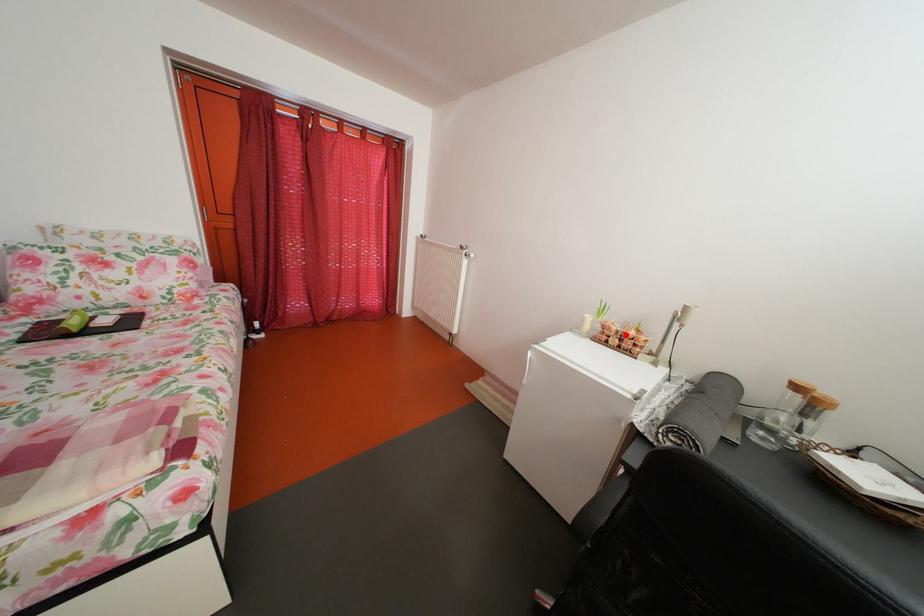
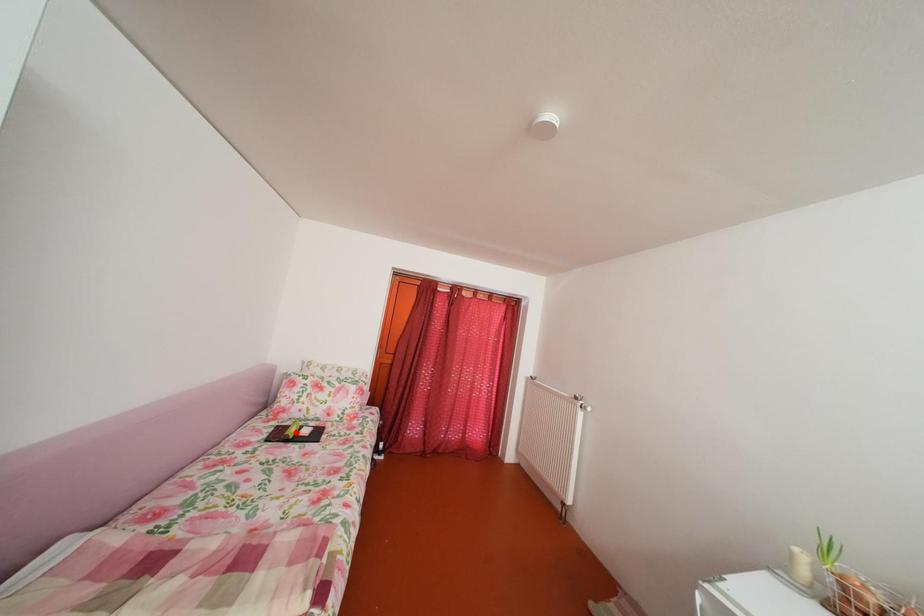
I am providing you with two images of the same scene from different viewpoints. A red point is marked on the first image and another point is marked on the second image. Are the points marked in image1 and image2 representing the same 3D position?

No